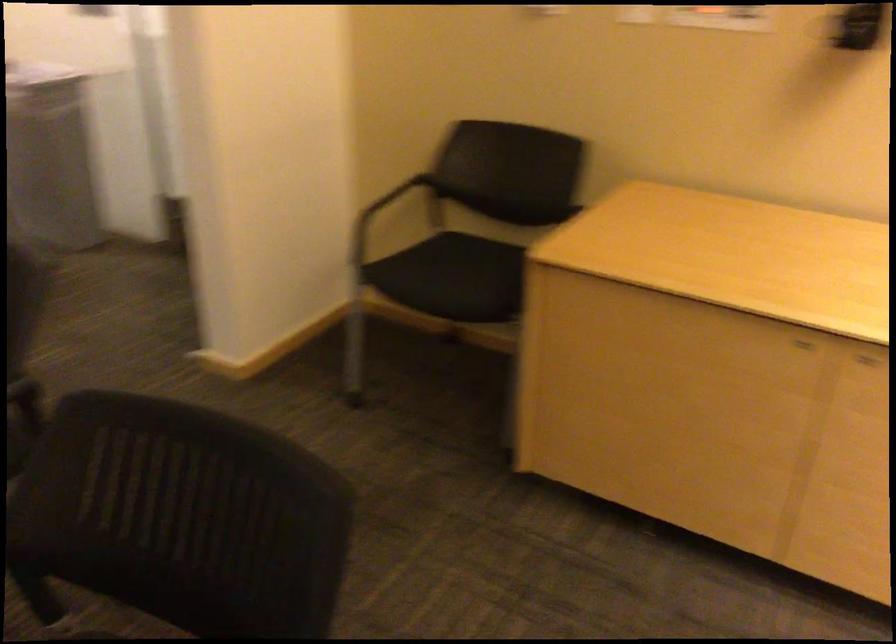
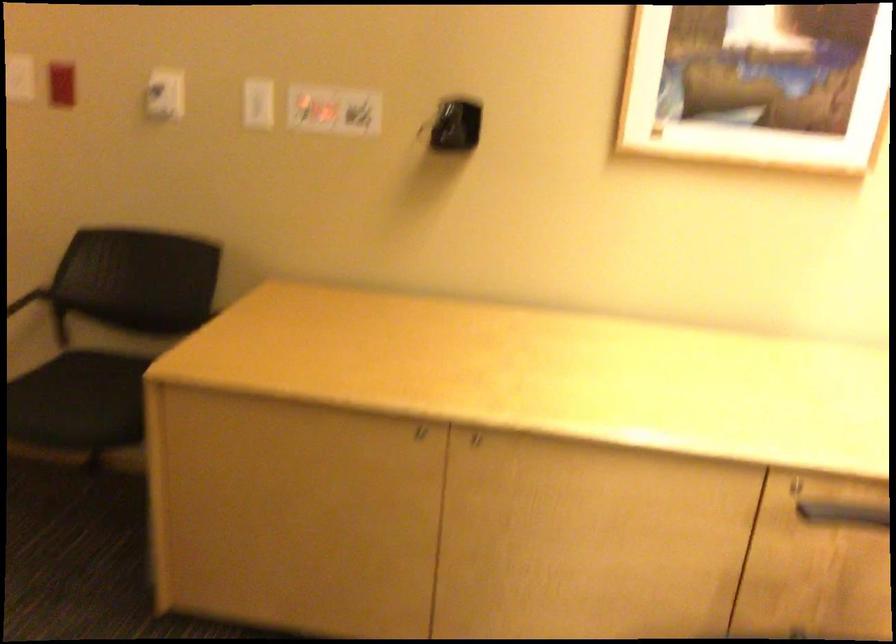
Locate, in the second image, the point that corresponds to [778,333] in the first image.

(410, 433)